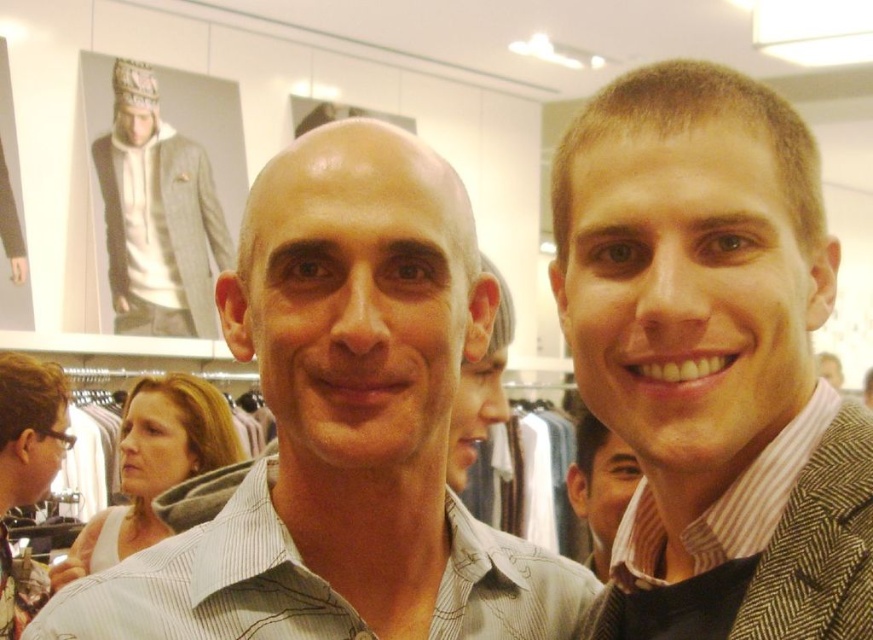
You are trying to decide between two items in a store. You see the striped shirt at center and the white cotton hoodie at upper left. Which item is smaller in size?

The striped shirt at center has a smaller size compared to the white cotton hoodie at upper left, so the striped shirt at center is smaller.

You are a store employee who needs to hang a new price tag between the striped shirt at center and the white cotton hoodie at upper left. Which item should you place the tag closer to?

The striped shirt at center is below the white cotton hoodie at upper left, so the price tag should be placed closer to the striped shirt at center since it is positioned lower than the hoodie.